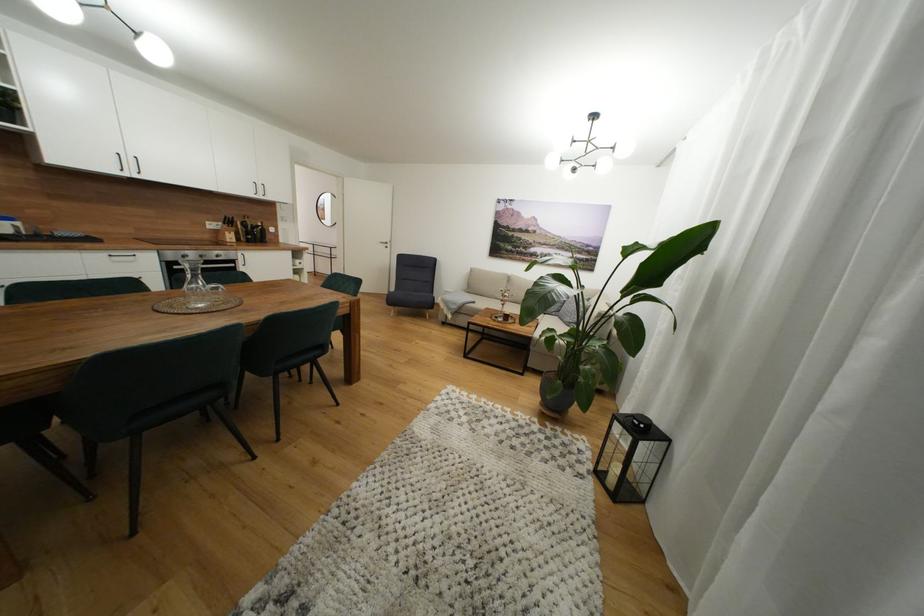
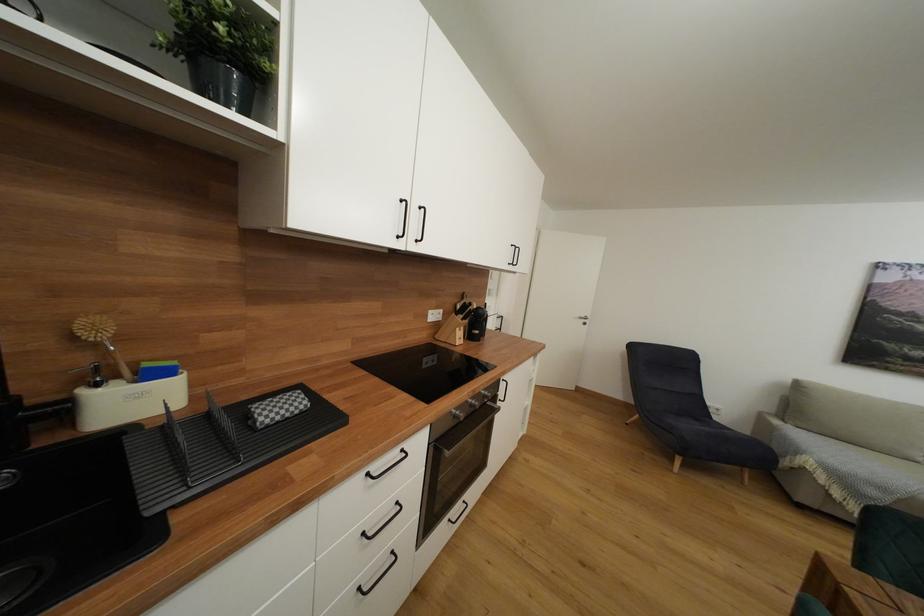
The images are taken continuously from a first-person perspective. In which direction are you moving?

The movement direction of the cameraman is left, forward.